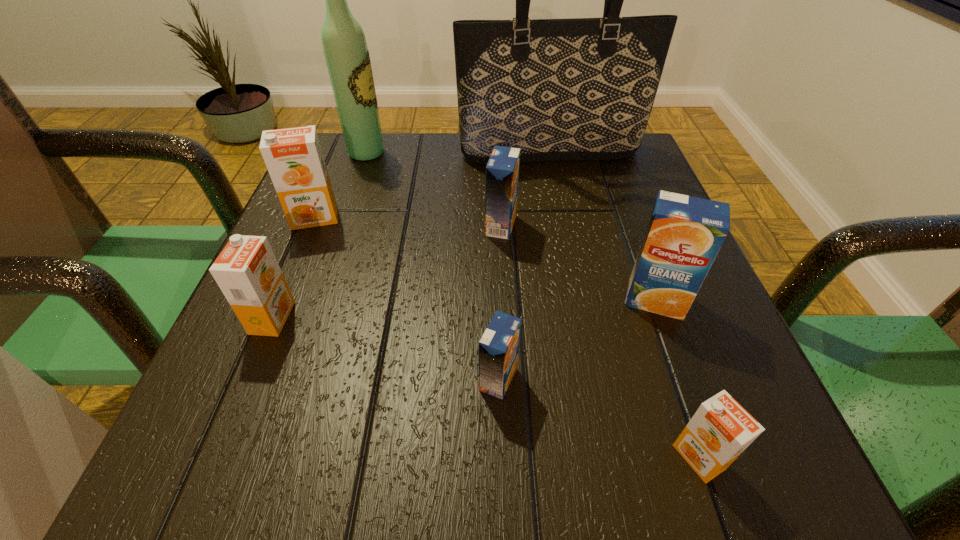
At what (x,y) coordinates should I click in order to perform the action: click on the second nearest orange juice. Please return your answer as a coordinate pair (x, y). Looking at the image, I should click on (498, 348).

This screenshot has height=540, width=960. Find the location of `the nearest object`. the nearest object is located at coordinates (721, 429).

Locate an element on the screen. the nearest orange orange juice is located at coordinates (721, 429).

Where is `free space located 0.200m on the front of the tote bag`? free space located 0.200m on the front of the tote bag is located at coordinates (566, 228).

Find the location of a particular element. free space located on the front-facing side of the wine bottle is located at coordinates (464, 153).

This screenshot has height=540, width=960. Identify the location of vacant space situated on the right of the biggest orange orange juice. (372, 218).

In order to click on vacant region located on the front of the second farthest blue orange_juice in this screenshot , I will do `click(673, 348)`.

Locate an element on the screen. free space located on the back of the second biggest blue orange_juice is located at coordinates (497, 153).

Image resolution: width=960 pixels, height=540 pixels. I want to click on blank space located on the back of the second smallest orange orange juice, so click(337, 164).

Find the location of a particular element. vacant space positioned on the back of the smallest blue orange_juice is located at coordinates (495, 287).